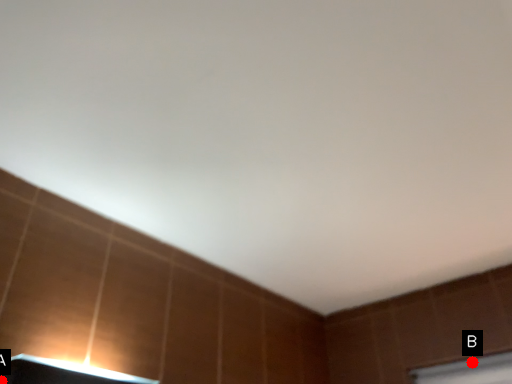
Question: Two points are circled on the image, labeled by A and B beside each circle. Which point is farther to the camera?

Choices:
 (A) A is further
 (B) B is further

Answer: (B)